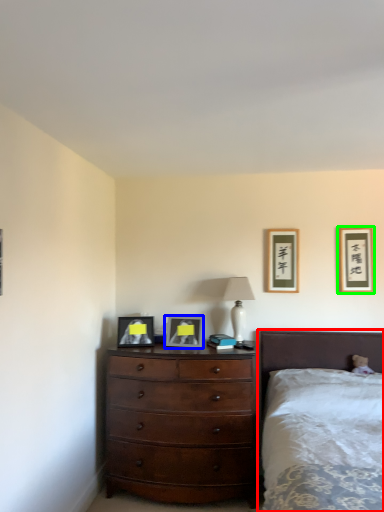
Question: Which object is positioned closest to bed (highlighted by a red box)? Select from picture frame (highlighted by a blue box) and picture frame (highlighted by a green box).

Choices:
 (A) picture frame
 (B) picture frame

Answer: (B)